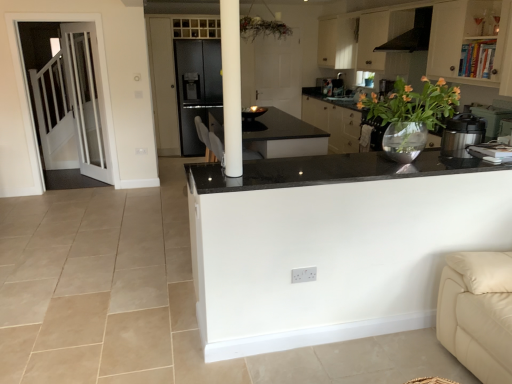
Question: Considering the relative sizes of metallic silver pressure cooker at right and white glass door at left in the image provided, is metallic silver pressure cooker at right smaller than white glass door at left?

Choices:
 (A) yes
 (B) no

Answer: (A)

Question: From a real-world perspective, does metallic silver pressure cooker at right stand above white glass door at left?

Choices:
 (A) no
 (B) yes

Answer: (B)

Question: Can white glass door at left be found inside metallic silver pressure cooker at right?

Choices:
 (A) no
 (B) yes

Answer: (A)

Question: From a real-world perspective, is metallic silver pressure cooker at right located beneath white glass door at left?

Choices:
 (A) yes
 (B) no

Answer: (B)

Question: From the image's perspective, is metallic silver pressure cooker at right below white glass door at left?

Choices:
 (A) yes
 (B) no

Answer: (A)

Question: Can you confirm if metallic silver pressure cooker at right is wider than white glass door at left?

Choices:
 (A) no
 (B) yes

Answer: (B)

Question: Is black granite countertop at center further to camera compared to black matte exhaust hood at upper right?

Choices:
 (A) yes
 (B) no

Answer: (B)

Question: Is black matte exhaust hood at upper right at the back of black granite countertop at center?

Choices:
 (A) no
 (B) yes

Answer: (A)

Question: Is black granite countertop at center closer to the viewer compared to black matte exhaust hood at upper right?

Choices:
 (A) no
 (B) yes

Answer: (B)

Question: Can you confirm if black granite countertop at center is positioned to the right of black matte exhaust hood at upper right?

Choices:
 (A) no
 (B) yes

Answer: (A)

Question: Is black granite countertop at center positioned beyond the bounds of black matte exhaust hood at upper right?

Choices:
 (A) no
 (B) yes

Answer: (B)

Question: From the image's perspective, is black granite countertop at center located above black matte exhaust hood at upper right?

Choices:
 (A) yes
 (B) no

Answer: (B)

Question: From a real-world perspective, does black matte exhaust hood at upper right sit lower than metallic silver pressure cooker at right?

Choices:
 (A) no
 (B) yes

Answer: (A)